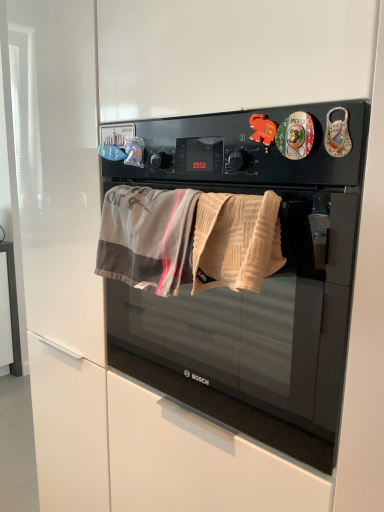
Measure the distance between point (241, 199) and camera.

27.17 inches.

What do you see at coordinates (262, 286) in the screenshot?
I see `black matte microwave oven at center` at bounding box center [262, 286].

Where is `black matte microwave oven at center`? This screenshot has width=384, height=512. black matte microwave oven at center is located at coordinates (262, 286).

This screenshot has width=384, height=512. Find the location of `beige textured towel at center, the 1th beach towel from the right`. beige textured towel at center, the 1th beach towel from the right is located at coordinates (236, 241).

Find the location of a particular element. microwave oven in front of the gray cotton beach towel at center, the second beach towel from the right is located at coordinates (262, 286).

Which point is more distant from viewer, (260, 312) or (170, 237)?

The point (260, 312) is farther.

Which object is positioned more to the right, black matte microwave oven at center or gray cotton beach towel at center, which appears as the first beach towel when viewed from the left?

Positioned to the right is black matte microwave oven at center.

From a real-world perspective, is black matte microwave oven at center located beneath gray cotton beach towel at center, the second beach towel from the right?

Yes, from a real-world perspective, black matte microwave oven at center is under gray cotton beach towel at center, the second beach towel from the right.

Based on the photo, could you tell me if beige textured towel at center, which ranks as the second beach towel in left-to-right order, is facing gray cotton beach towel at center, which appears as the first beach towel when viewed from the left?

No, beige textured towel at center, which ranks as the second beach towel in left-to-right order, is not aimed at gray cotton beach towel at center, which appears as the first beach towel when viewed from the left.

Is beige textured towel at center, the 1th beach towel from the right, positioned in front of gray cotton beach towel at center, the second beach towel from the right?

Yes, it is in front of gray cotton beach towel at center, the second beach towel from the right.

Looking at this image, can you see beige textured towel at center, which ranks as the second beach towel in left-to-right order, touching gray cotton beach towel at center, which appears as the first beach towel when viewed from the left?

beige textured towel at center, which ranks as the second beach towel in left-to-right order, and gray cotton beach towel at center, which appears as the first beach towel when viewed from the left, are not in contact.

Is beige textured towel at center, which ranks as the second beach towel in left-to-right order, at the right side of gray cotton beach towel at center, which appears as the first beach towel when viewed from the left?

Yes, beige textured towel at center, which ranks as the second beach towel in left-to-right order, is to the right of gray cotton beach towel at center, which appears as the first beach towel when viewed from the left.

Looking at this image, from their relative heights in the image, would you say black matte microwave oven at center is taller or shorter than beige textured towel at center, the 1th beach towel from the right?

Clearly, black matte microwave oven at center is taller compared to beige textured towel at center, the 1th beach towel from the right.

Is black matte microwave oven at center positioned with its back to beige textured towel at center, the 1th beach towel from the right?

No.

How different are the orientations of black matte microwave oven at center and beige textured towel at center, which ranks as the second beach towel in left-to-right order, in degrees?

The angular difference between black matte microwave oven at center and beige textured towel at center, which ranks as the second beach towel in left-to-right order, is 1.96 degrees.

Are beige textured towel at center, which ranks as the second beach towel in left-to-right order, and black matte microwave oven at center located far from each other?

No, beige textured towel at center, which ranks as the second beach towel in left-to-right order, is not far from black matte microwave oven at center.

From the image's perspective, which is below, beige textured towel at center, the 1th beach towel from the right, or black matte microwave oven at center?

From the image's view, black matte microwave oven at center is below.

Is beige textured towel at center, the 1th beach towel from the right, shorter than black matte microwave oven at center?

Yes.

Is beige textured towel at center, the 1th beach towel from the right, turned away from black matte microwave oven at center?

Correct, beige textured towel at center, the 1th beach towel from the right, is looking away from black matte microwave oven at center.

From a real-world perspective, is gray cotton beach towel at center, the second beach towel from the right, under black matte microwave oven at center?

Incorrect, from a real-world perspective, gray cotton beach towel at center, the second beach towel from the right, is higher than black matte microwave oven at center.

Which of these two, gray cotton beach towel at center, the second beach towel from the right, or black matte microwave oven at center, stands shorter?

gray cotton beach towel at center, the second beach towel from the right, is shorter.

From the image's perspective, which one is positioned higher, gray cotton beach towel at center, the second beach towel from the right, or black matte microwave oven at center?

gray cotton beach towel at center, the second beach towel from the right.

Can you confirm if gray cotton beach towel at center, which appears as the first beach towel when viewed from the left, is positioned to the right of beige textured towel at center, the 1th beach towel from the right?

Incorrect, gray cotton beach towel at center, which appears as the first beach towel when viewed from the left, is not on the right side of beige textured towel at center, the 1th beach towel from the right.

Is gray cotton beach towel at center, the second beach towel from the right, positioned behind beige textured towel at center, the 1th beach towel from the right?

Yes.

Is gray cotton beach towel at center, which appears as the first beach towel when viewed from the left, outside of beige textured towel at center, which ranks as the second beach towel in left-to-right order?

Yes, gray cotton beach towel at center, which appears as the first beach towel when viewed from the left, is located beyond the bounds of beige textured towel at center, which ranks as the second beach towel in left-to-right order.

The width and height of the screenshot is (384, 512). There is a black matte microwave oven at center. Identify the location of the 2nd beach towel above it (from the image's perspective). (147, 237).

You are a GUI agent. You are given a task and a screenshot of the screen. Output one action in this format:
    pyautogui.click(x=<x>, y=<y>)
    Task: Click on the beach towel located behind the beige textured towel at center, which ranks as the second beach towel in left-to-right order
    This screenshot has width=384, height=512.
    Given the screenshot: What is the action you would take?
    pyautogui.click(x=147, y=237)

From the image, which object appears to be nearer to gray cotton beach towel at center, which appears as the first beach towel when viewed from the left, beige textured towel at center, the 1th beach towel from the right, or black matte microwave oven at center?

beige textured towel at center, the 1th beach towel from the right.

Looking at the image, which one is located further to beige textured towel at center, which ranks as the second beach towel in left-to-right order, black matte microwave oven at center or gray cotton beach towel at center, the second beach towel from the right?

Among the two, black matte microwave oven at center is located further to beige textured towel at center, which ranks as the second beach towel in left-to-right order.

Which object lies nearer to the anchor point black matte microwave oven at center, gray cotton beach towel at center, the second beach towel from the right, or beige textured towel at center, which ranks as the second beach towel in left-to-right order?

Based on the image, gray cotton beach towel at center, the second beach towel from the right, appears to be nearer to black matte microwave oven at center.

Estimate the real-world distances between objects in this image. Which object is further from beige textured towel at center, which ranks as the second beach towel in left-to-right order, gray cotton beach towel at center, the second beach towel from the right, or black matte microwave oven at center?

Based on the image, black matte microwave oven at center appears to be further to beige textured towel at center, which ranks as the second beach towel in left-to-right order.

From the image, which object appears to be farther from gray cotton beach towel at center, which appears as the first beach towel when viewed from the left, black matte microwave oven at center or beige textured towel at center, the 1th beach towel from the right?

Among the two, black matte microwave oven at center is located further to gray cotton beach towel at center, which appears as the first beach towel when viewed from the left.

Estimate the real-world distances between objects in this image. Which object is further from black matte microwave oven at center, beige textured towel at center, which ranks as the second beach towel in left-to-right order, or gray cotton beach towel at center, which appears as the first beach towel when viewed from the left?

Among the two, beige textured towel at center, which ranks as the second beach towel in left-to-right order, is located further to black matte microwave oven at center.

Locate an element on the screen. beach towel between gray cotton beach towel at center, the second beach towel from the right, and black matte microwave oven at center, in the horizontal direction is located at coordinates (236, 241).